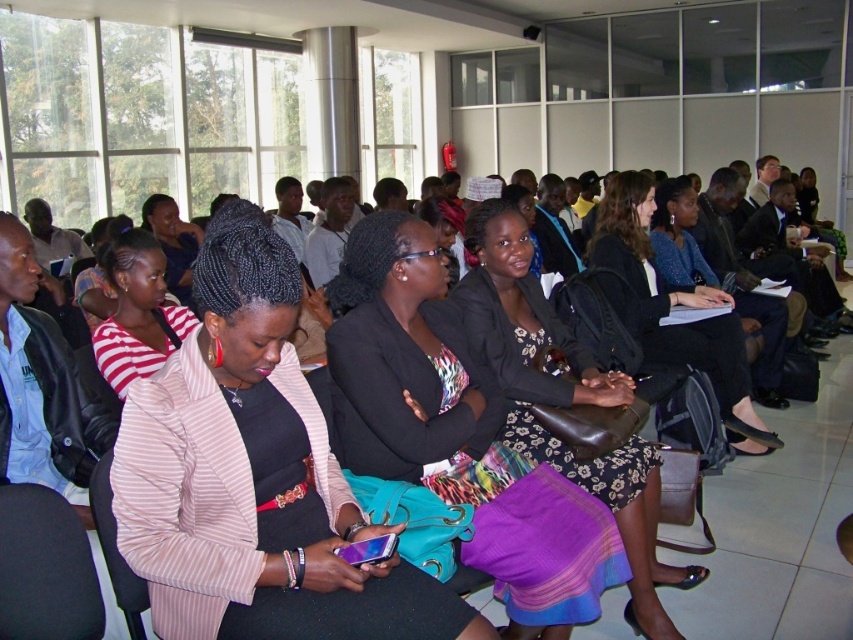
Can you confirm if matte black blazer at center is thinner than black leather jacket at center?

Indeed, matte black blazer at center has a lesser width compared to black leather jacket at center.

Is the position of matte black blazer at center more distant than that of black leather jacket at center?

No, matte black blazer at center is closer to the viewer.

Between point (450, 492) and point (642, 346), which one is positioned in front?

Point (450, 492) is in front.

Where is `matte black blazer at center`? matte black blazer at center is located at coordinates (456, 429).

Find the location of a particular element. The width and height of the screenshot is (853, 640). floral-patterned dress at center is located at coordinates (563, 401).

Which is in front, point (645, 604) or point (117, 356)?

Point (645, 604)

This screenshot has height=640, width=853. Identify the location of floral-patterned dress at center. (563, 401).

Which is more to the left, floral-patterned dress at center or black leather jacket at center?

floral-patterned dress at center is more to the left.

Is floral-patterned dress at center smaller than black leather jacket at center?

Correct, floral-patterned dress at center occupies less space than black leather jacket at center.

Does point (491, 221) come closer to viewer compared to point (611, 188)?

Yes, it is.

Where is `floral-patterned dress at center`? The image size is (853, 640). floral-patterned dress at center is located at coordinates (563, 401).